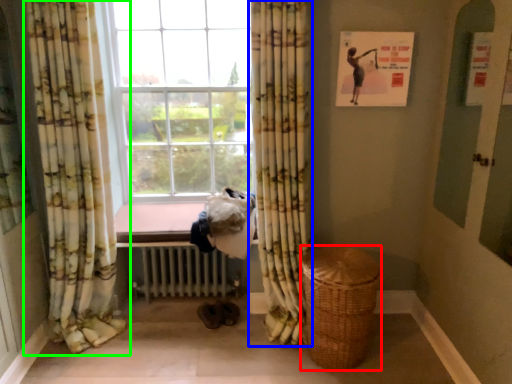
Question: Which object is positioned closest to basket (highlighted by a red box)? Select from curtain (highlighted by a blue box) and curtain (highlighted by a green box).

Choices:
 (A) curtain
 (B) curtain

Answer: (A)